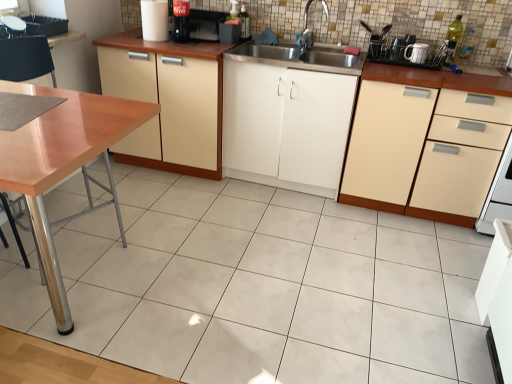
In order to click on vacant space in front of black plastic dish rack at upper right, acting as the third appliance starting from the left in this screenshot , I will do `click(403, 76)`.